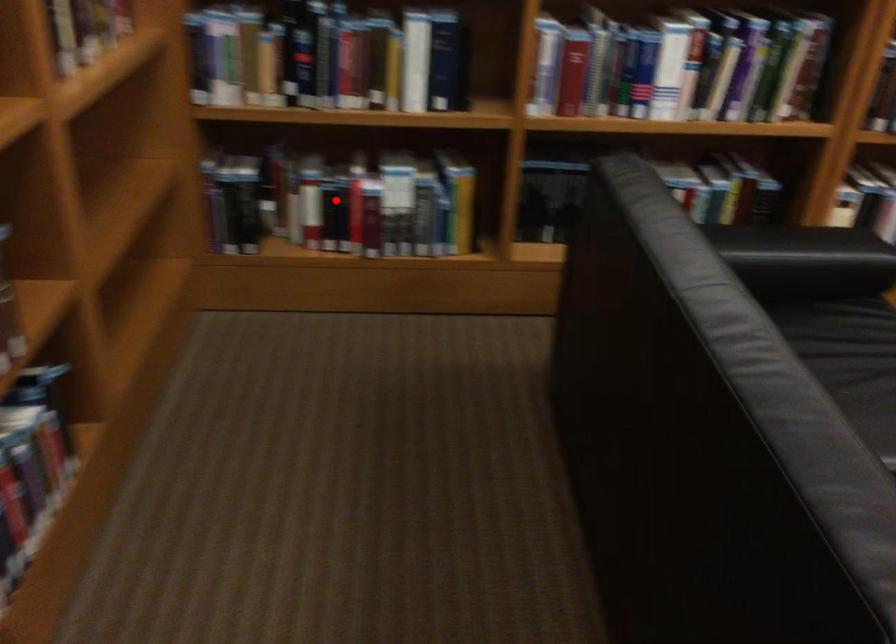
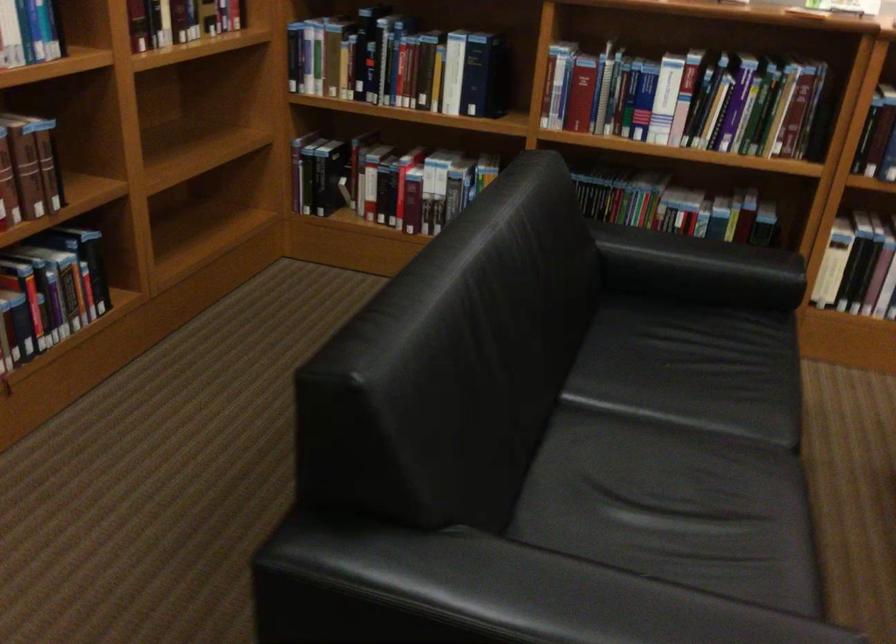
The point at the highlighted location is marked in the first image. Where is the corresponding point in the second image?

(385, 182)